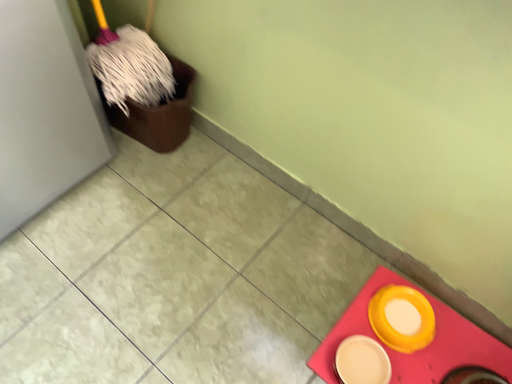
At what (x,y) coordinates should I click in order to perform the action: click on vacant space that is to the left of yellow matte bowl at lower right, the first tableware in the right-to-left sequence. Please return your answer as a coordinate pair (x, y). Looking at the image, I should click on (327, 305).